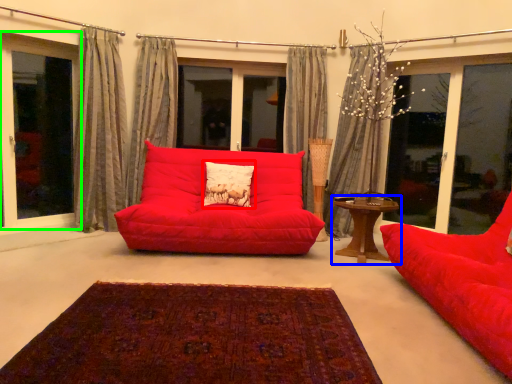
Question: Which is nearer to the pillow (highlighted by a red box)? table (highlighted by a blue box) or window (highlighted by a green box).

Choices:
 (A) table
 (B) window

Answer: (A)